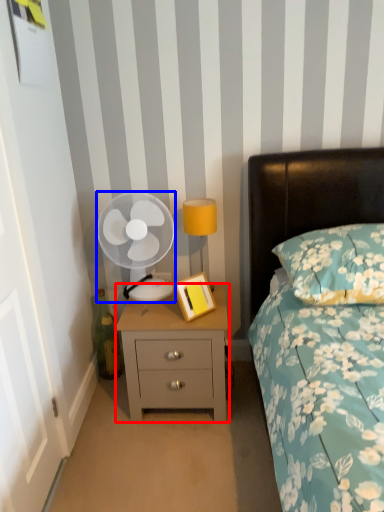
Question: Which point is closer to the camera, nightstand (highlighted by a red box) or mechanical fan (highlighted by a blue box)?

Choices:
 (A) nightstand
 (B) mechanical fan

Answer: (A)